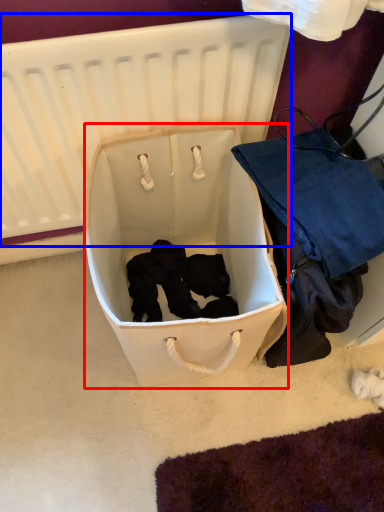
Question: Which object is further to the camera taking this photo, storage box (highlighted by a red box) or infant bed (highlighted by a blue box)?

Choices:
 (A) storage box
 (B) infant bed

Answer: (A)